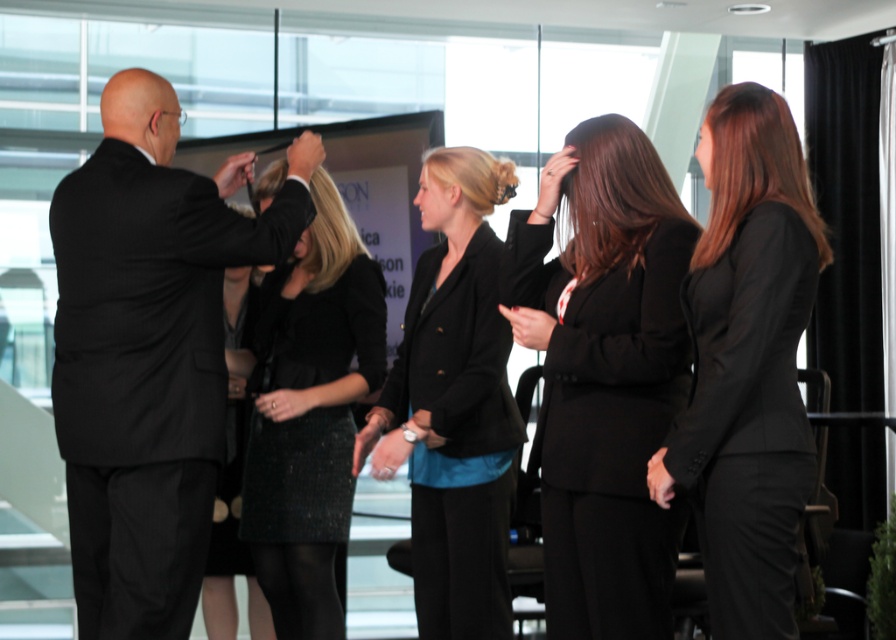
Consider the image. Which is more to the left, black textured suit at left or black sequined skirt at center?

black textured suit at left

Identify the location of black textured suit at left. (145, 356).

This screenshot has height=640, width=896. Identify the location of black textured suit at left. (145, 356).

Is black smooth suit at right below matte black blazer at center?

No, black smooth suit at right is not below matte black blazer at center.

Can you confirm if black smooth suit at right is positioned above matte black blazer at center?

Indeed, black smooth suit at right is positioned over matte black blazer at center.

Between point (737, 554) and point (409, 401), which one is positioned behind?

The point (409, 401) is more distant.

Identify the location of black smooth suit at right. (747, 364).

Between black textured suit at left and matte black blazer at center, which one is positioned higher?

black textured suit at left

Is black textured suit at left to the right of matte black blazer at center from the viewer's perspective?

In fact, black textured suit at left is to the left of matte black blazer at center.

Is point (152, 355) positioned behind point (495, 372)?

That is False.

This screenshot has width=896, height=640. What are the coordinates of `black textured suit at left` in the screenshot? It's located at (145, 356).